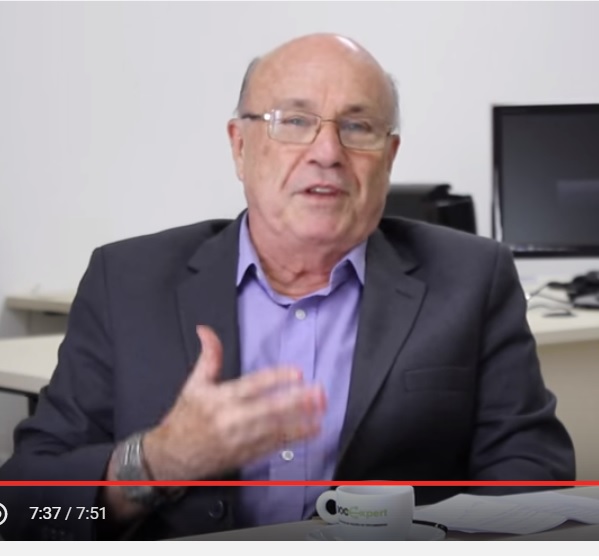
Find the location of a particular element. The image size is (599, 560). desk is located at coordinates (25, 349).